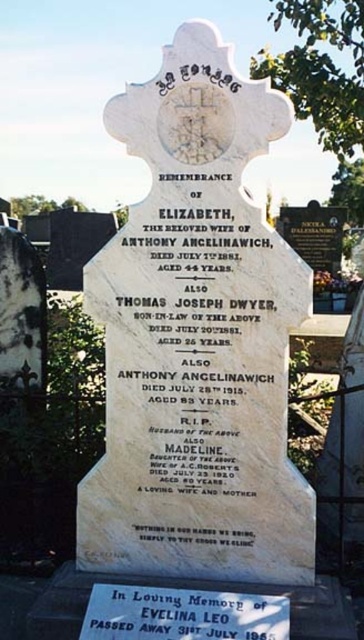
Question: Where is white marble gravestone at center located in relation to white marble plaque at lower center in the image?

Choices:
 (A) right
 (B) left

Answer: (B)

Question: Which point is closer to the camera taking this photo?

Choices:
 (A) (255, 595)
 (B) (196, 396)

Answer: (A)

Question: Is white marble gravestone at center closer to the viewer compared to white marble plaque at lower center?

Choices:
 (A) yes
 (B) no

Answer: (B)

Question: Does white marble gravestone at center have a greater width compared to white marble plaque at lower center?

Choices:
 (A) no
 (B) yes

Answer: (B)

Question: Which point is farther to the camera?

Choices:
 (A) (286, 403)
 (B) (104, 586)

Answer: (A)